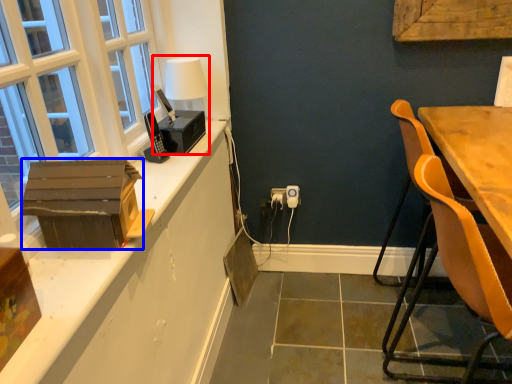
Question: Which of the following is the closest to the observer, table lamp (highlighted by a red box) or cardboard box (highlighted by a blue box)?

Choices:
 (A) table lamp
 (B) cardboard box

Answer: (B)